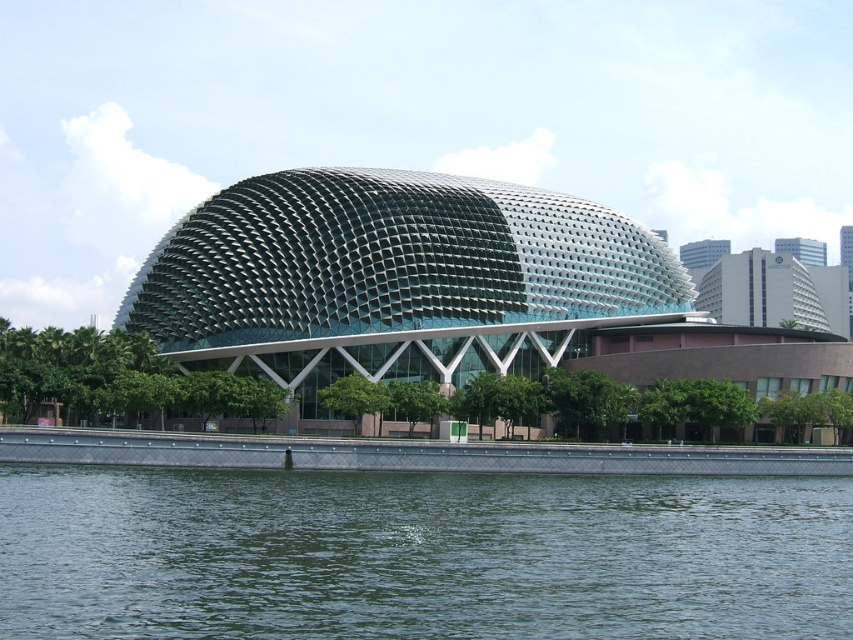
You are standing in front of the green textured dome at center and want to reach the green water at lower center. Which direction should you move to get there?

You should move to the left to reach the green water at lower center since it is located to the left of the green textured dome at center.

You are standing in front of the dome building and want to take a photo that includes both the green water at lower center and the green textured dome at center. Which object should you focus on first to ensure both are in the frame?

Since the green water at lower center is smaller in size compared to the green textured dome at center, you should focus on framing the larger dome first to ensure both fit in the photo.

You are standing in front of the green textured dome at center and want to see the green water at lower center. In which direction should you look relative to the dome?

You should look downward towards the green water at lower center since it is located below the green textured dome at center.